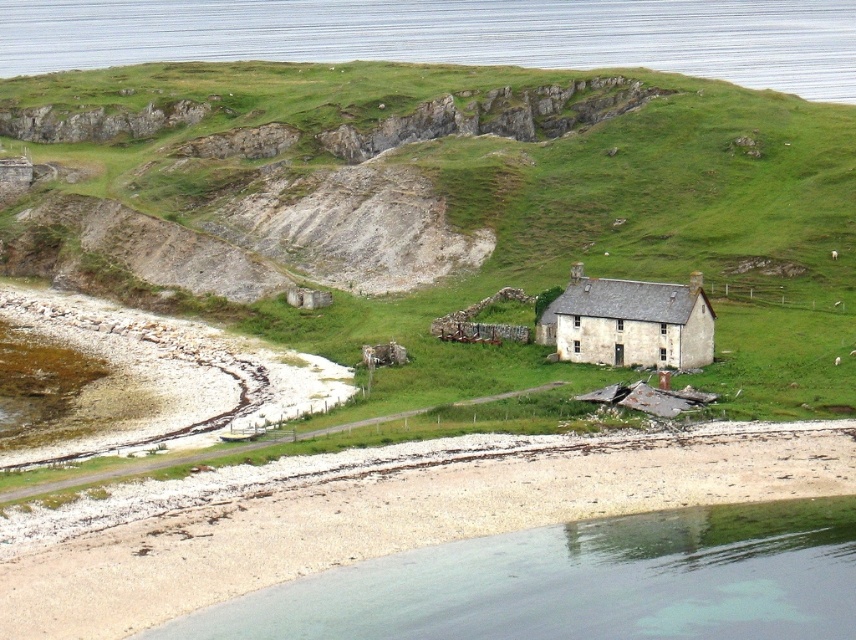
You are planning to build a small garden between the green grass at upper center and the weathered stone cottage at center. Considering their sizes, which area would be more suitable for planting flowers?

The green grass at upper center might be wider than the weathered stone cottage at center, so it would be more suitable for planting flowers as it offers a larger space.

You are standing at the base of the hill near the beach and want to reach the stone house on the hill. You notice two landmarks marked as point (652, 88) and point (682, 348). Which point should you head towards first if you want to take the shortest path to the house?

Point (652, 88) is closer to you than point (682, 348), so you should head towards point (652, 88) first to take the shortest path to the stone house.